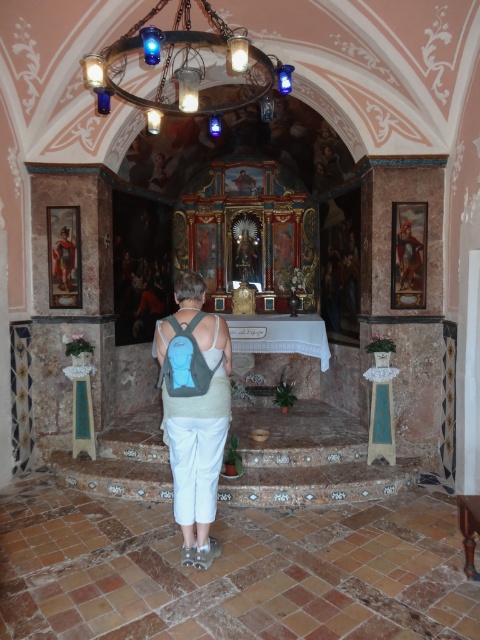
Can you confirm if metallic ring at upper center is positioned above matte gold statue at left?

Yes.

Who is positioned more to the left, metallic ring at upper center or matte gold statue at left?

matte gold statue at left

Does point (156, 132) come closer to viewer compared to point (58, 272)?

Yes.

Where is `metallic ring at upper center`? This screenshot has width=480, height=640. metallic ring at upper center is located at coordinates [x=189, y=68].

Which is below, gray fabric backpack at center or matte gold statue at left?

gray fabric backpack at center

Can you confirm if gray fabric backpack at center is shorter than matte gold statue at left?

No, gray fabric backpack at center is not shorter than matte gold statue at left.

You are a GUI agent. You are given a task and a screenshot of the screen. Output one action in this format:
    pyautogui.click(x=<x>, y=<y>)
    Task: Click on the gray fabric backpack at center
    
    Given the screenshot: What is the action you would take?
    pyautogui.click(x=195, y=419)

Between point (284, 65) and point (162, 323), which one is positioned in front?

Positioned in front is point (284, 65).

Who is shorter, metallic ring at upper center or gray fabric backpack at center?

With less height is metallic ring at upper center.

What do you see at coordinates (189, 68) in the screenshot? I see `metallic ring at upper center` at bounding box center [189, 68].

Where is `metallic ring at upper center`? This screenshot has height=640, width=480. metallic ring at upper center is located at coordinates pyautogui.click(x=189, y=68).